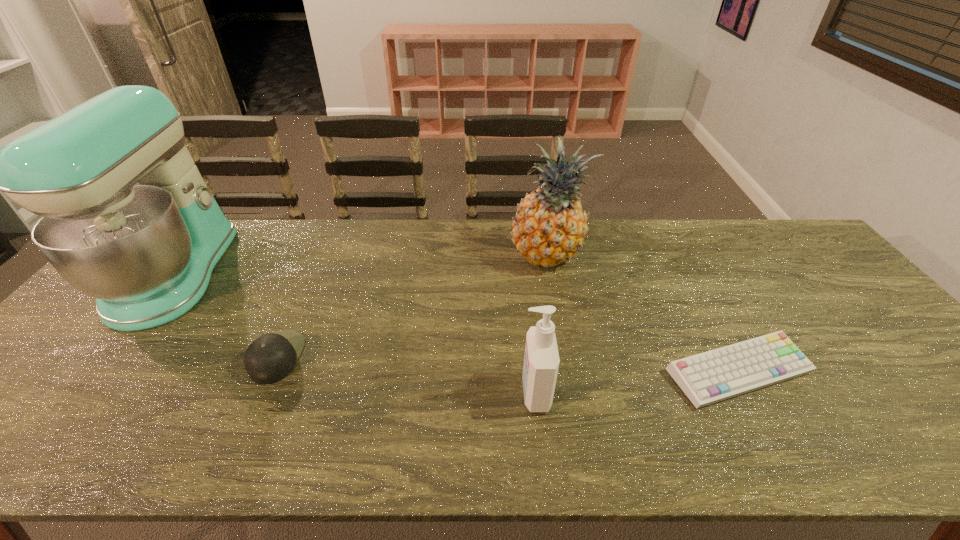
What are the coordinates of `free space located 0.230m on the front label of the cleansing agent` in the screenshot? It's located at (420, 393).

Where is `free location located 0.320m on the front label of the cleansing agent`? The width and height of the screenshot is (960, 540). free location located 0.320m on the front label of the cleansing agent is located at coordinates (381, 393).

This screenshot has height=540, width=960. In order to click on vacant region located 0.380m on the front label of the cleansing agent in this screenshot , I will do `click(355, 393)`.

Locate an element on the screen. free space located 0.240m on the brim of the second shortest object is located at coordinates tap(397, 357).

At what (x,y) coordinates should I click in order to perform the action: click on vacant space located 0.290m on the back of the computer keyboard. Please return your answer as a coordinate pair (x, y). The width and height of the screenshot is (960, 540). Looking at the image, I should click on (682, 267).

Identify the location of mixer that is positioned at the far edge. (127, 218).

Identify the location of pineapple at the far edge. This screenshot has height=540, width=960. (549, 227).

This screenshot has height=540, width=960. I want to click on object that is at the left edge, so 127,218.

At what (x,y) coordinates should I click in order to perform the action: click on object present at the far left corner. Please return your answer as a coordinate pair (x, y). Looking at the image, I should click on (127, 218).

I want to click on vacant region at the far edge of the desktop, so click(677, 220).